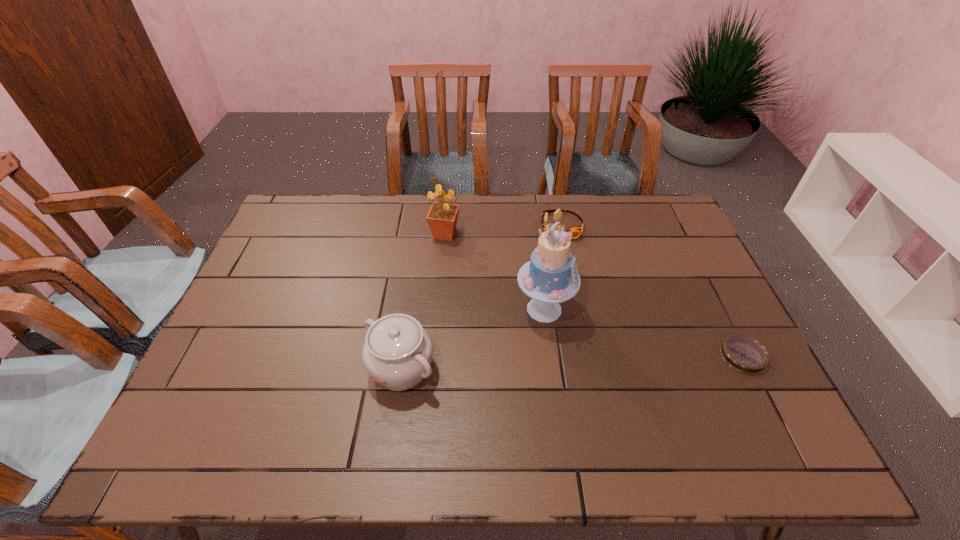
This screenshot has width=960, height=540. In order to click on free space on the desktop that is between the chinaware and the shortest object and is positioned at the front of the second tallest object with flowers visible in this screenshot , I will do `click(574, 362)`.

This screenshot has height=540, width=960. I want to click on vacant spot on the desktop that is between the third tallest object and the shortest object and is positioned with a ladder on the side of the third farthest object, so click(x=607, y=361).

Where is `free space on the desktop that is between the third shortest object and the rightmost object and is positioned with the lenses facing forward on the second shortest object`? free space on the desktop that is between the third shortest object and the rightmost object and is positioned with the lenses facing forward on the second shortest object is located at coordinates (594, 361).